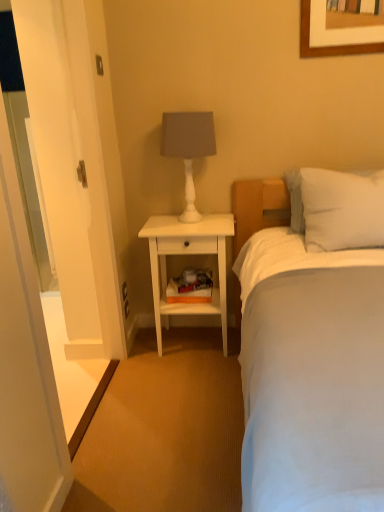
This screenshot has width=384, height=512. Find the location of `white soft bed at center`. white soft bed at center is located at coordinates (307, 362).

This screenshot has width=384, height=512. What do you see at coordinates (307, 362) in the screenshot?
I see `white soft bed at center` at bounding box center [307, 362].

This screenshot has width=384, height=512. I want to click on white soft pillow at upper right, so click(342, 210).

Considering the sizes of white glossy door at left and white wood nightstand at center in the image, is white glossy door at left taller or shorter than white wood nightstand at center?

Clearly, white glossy door at left is taller compared to white wood nightstand at center.

From the image's perspective, between white glossy door at left and white wood nightstand at center, which one is located above?

white glossy door at left.

At what (x,y) coordinates should I click in order to perform the action: click on glass door above the white wood nightstand at center (from the image's perspective). Please return your answer as a coordinate pair (x, y). The height and width of the screenshot is (512, 384). Looking at the image, I should click on (60, 161).

Looking at this image, is white glossy door at left turned away from white soft bed at center?

No.

Can you confirm if white glossy door at left is shorter than white soft bed at center?

In fact, white glossy door at left may be taller than white soft bed at center.

Would you say white glossy door at left is outside white soft bed at center?

white glossy door at left is positioned outside white soft bed at center.

Between white glossy door at left and white soft bed at center, which one appears on the left side from the viewer's perspective?

Positioned to the left is white glossy door at left.

Can you confirm if white wood nightstand at center is thinner than white glossy door at left?

Incorrect, the width of white wood nightstand at center is not less than that of white glossy door at left.

Is white wood nightstand at center looking in the opposite direction of white glossy door at left?

No, white wood nightstand at center is not facing the opposite direction of white glossy door at left.

Is white wood nightstand at center inside or outside of white glossy door at left?

white wood nightstand at center is not enclosed by white glossy door at left.

Looking at this image, from a real-world perspective, is white wood nightstand at center under white glossy door at left?

Indeed, from a real-world perspective, white wood nightstand at center is positioned beneath white glossy door at left.

Based on the photo, does white soft pillow at upper right turn towards white soft bed at center?

Yes, white soft pillow at upper right is aimed at white soft bed at center.

Is white soft pillow at upper right located outside white soft bed at center?

No, white soft pillow at upper right is inside or overlapping with white soft bed at center.

In the image, is white soft pillow at upper right positioned in front of or behind white soft bed at center?

In the image, white soft pillow at upper right appears behind white soft bed at center.

Is white soft pillow at upper right not close to white soft bed at center?

That's not correct — white soft pillow at upper right is a little close to white soft bed at center.

Based on their positions, is white soft bed at center located to the left or right of white soft pillow at upper right?

From the image, it's evident that white soft bed at center is to the left of white soft pillow at upper right.

Consider the image. Does white soft bed at center have a smaller size compared to white soft pillow at upper right?

No.

Choose the correct answer: Is white soft bed at center inside white soft pillow at upper right or outside it?

white soft bed at center is located beyond the bounds of white soft pillow at upper right.

From the image's perspective, is white soft bed at center under white soft pillow at upper right?

Indeed, from the image's perspective, white soft bed at center is shown beneath white soft pillow at upper right.

Does white soft bed at center touch white matte table lamp at upper center?

There is a gap between white soft bed at center and white matte table lamp at upper center.

Is white matte table lamp at upper center at the back of white soft bed at center?

white soft bed at center is not turned away from white matte table lamp at upper center.

Is white soft bed at center wider or thinner than white matte table lamp at upper center?

Clearly, white soft bed at center has more width compared to white matte table lamp at upper center.

Between white soft bed at center and white matte table lamp at upper center, which one appears on the right side from the viewer's perspective?

Positioned to the right is white soft bed at center.

Would you consider white matte table lamp at upper center to be distant from white soft bed at center?

No, there isn't a large distance between white matte table lamp at upper center and white soft bed at center.

Find the location of `bed located in front of the white matte table lamp at upper center`. bed located in front of the white matte table lamp at upper center is located at coordinates (307, 362).

Would you say white soft bed at center is part of white matte table lamp at upper center's contents?

No, white matte table lamp at upper center does not contain white soft bed at center.

From the image's perspective, is white matte table lamp at upper center on white soft bed at center?

Correct, white matte table lamp at upper center appears higher than white soft bed at center in the image.

I want to click on nightstand below the white glossy door at left (from the image's perspective), so click(x=188, y=255).

You are a GUI agent. You are given a task and a screenshot of the screen. Output one action in this format:
    pyautogui.click(x=<x>, y=<y>)
    Task: Click on the glass door positioned vertically above the white soft bed at center (from a real-world perspective)
    The width and height of the screenshot is (384, 512).
    Given the screenshot: What is the action you would take?
    pyautogui.click(x=60, y=161)

Considering their positions, is white soft pillow at upper right positioned further to white soft bed at center than white glossy door at left?

Among the two, white glossy door at left is located further to white soft bed at center.

Considering their positions, is white matte table lamp at upper center positioned closer to white wood nightstand at center than white soft pillow at upper right?

white matte table lamp at upper center is closer to white wood nightstand at center.

Considering their positions, is white soft pillow at upper right positioned further to white matte table lamp at upper center than white glossy door at left?

Based on the image, white soft pillow at upper right appears to be further to white matte table lamp at upper center.

Looking at the image, which one is located closer to white soft pillow at upper right, white matte table lamp at upper center or white glossy door at left?

white matte table lamp at upper center is positioned closer to the anchor white soft pillow at upper right.

Estimate the real-world distances between objects in this image. Which object is further from white wood nightstand at center, white soft bed at center or white soft pillow at upper right?

white soft bed at center is further to white wood nightstand at center.

Estimate the real-world distances between objects in this image. Which object is further from white matte table lamp at upper center, white soft bed at center or white wood nightstand at center?

white soft bed at center lies further to white matte table lamp at upper center than the other object.

Considering their positions, is white soft bed at center positioned closer to white glossy door at left than white soft pillow at upper right?

white soft bed at center is closer to white glossy door at left.

Estimate the real-world distances between objects in this image. Which object is closer to white soft pillow at upper right, white matte table lamp at upper center or white soft bed at center?

white soft bed at center lies closer to white soft pillow at upper right than the other object.

Locate an element on the screen. pillow between white soft bed at center and white glossy door at left from front to back is located at coordinates (342, 210).

Locate an element on the screen. The width and height of the screenshot is (384, 512). nightstand between white soft bed at center and white glossy door at left from front to back is located at coordinates click(188, 255).

The height and width of the screenshot is (512, 384). I want to click on table lamp between white soft bed at center and white glossy door at left in the front-back direction, so click(x=188, y=148).

The width and height of the screenshot is (384, 512). Find the location of `pillow between white soft bed at center and white matte table lamp at upper center along the z-axis`. pillow between white soft bed at center and white matte table lamp at upper center along the z-axis is located at coordinates (342, 210).